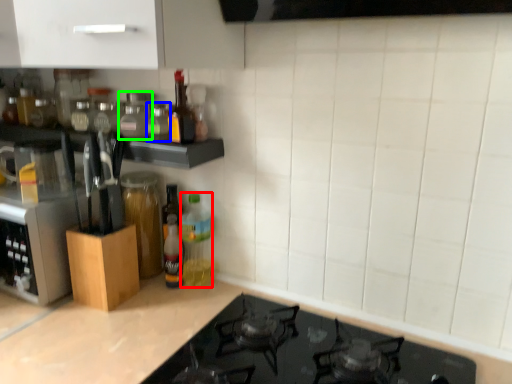
Question: Which object is the farthest from bottle (highlighted by a red box)? Choose among these: bottle (highlighted by a blue box) or bottle (highlighted by a green box).

Choices:
 (A) bottle
 (B) bottle

Answer: (B)